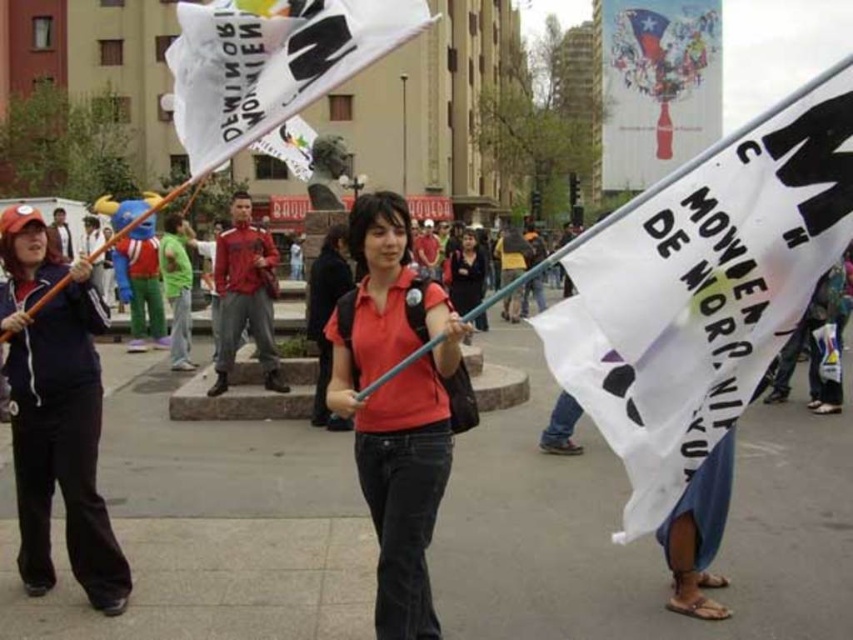
Question: From the image, what is the correct spatial relationship of white paper flag at center in relation to matte red shirt at center?

Choices:
 (A) left
 (B) right

Answer: (B)

Question: Which of the following is the farthest from the observer?

Choices:
 (A) matte black jacket at center
 (B) white paper flag at center
 (C) white paper flag at upper center
 (D) matte red shirt at center

Answer: (A)

Question: Can you confirm if matte red shirt at center is bigger than matte black jacket at center?

Choices:
 (A) no
 (B) yes

Answer: (A)

Question: Estimate the real-world distances between objects in this image. Which object is closer to the matte red shirt at center?

Choices:
 (A) white paper flag at center
 (B) white paper flag at upper center

Answer: (A)

Question: In this image, where is matte red shirt at center located relative to white paper flag at upper center?

Choices:
 (A) below
 (B) above

Answer: (A)

Question: Which object is closer to the camera taking this photo?

Choices:
 (A) white paper flag at upper center
 (B) white paper flag at center

Answer: (B)